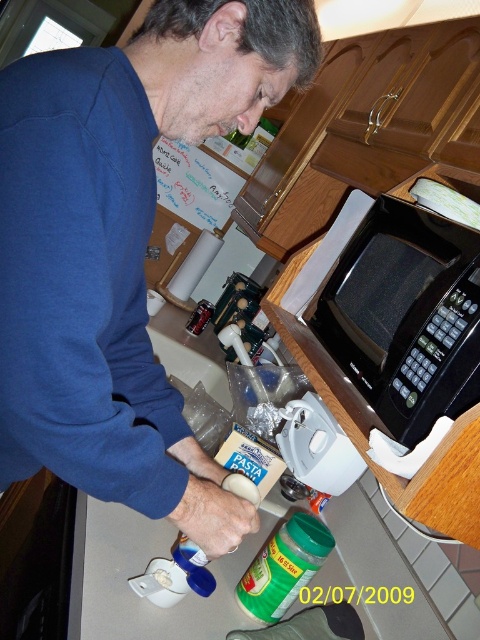
You are standing in the kitchen and want to place a small bowl between the two points labeled point (120, 282) and point (160, 568). Which point should the bowl be closer to in order to be nearer to the viewer?

The bowl should be placed closer to point (120, 282) because it is closer to the viewer than point (160, 568).

Looking at this image, you need to place a rectangular box that is 1.2 meters wide on the white glossy counter top at lower center or the black plastic microwave at upper right. Which surface can accommodate it based on their widths?

The white glossy counter top at lower center might be wider than the black plastic microwave at upper right, so it is more likely to accommodate the 1.2 meter wide box.